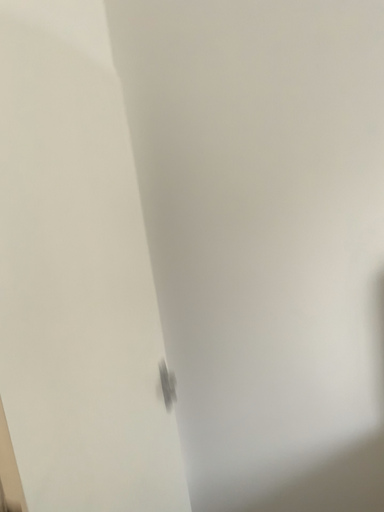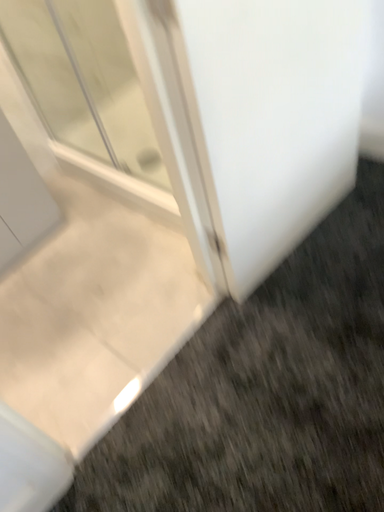
Question: Which way did the camera rotate in the video?

Choices:
 (A) rotated downward
 (B) rotated upward

Answer: (A)